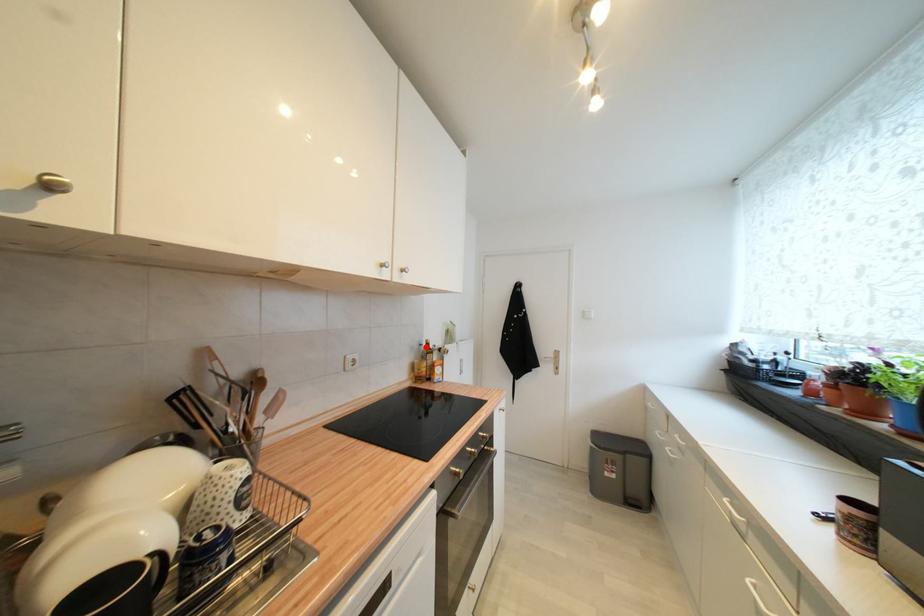
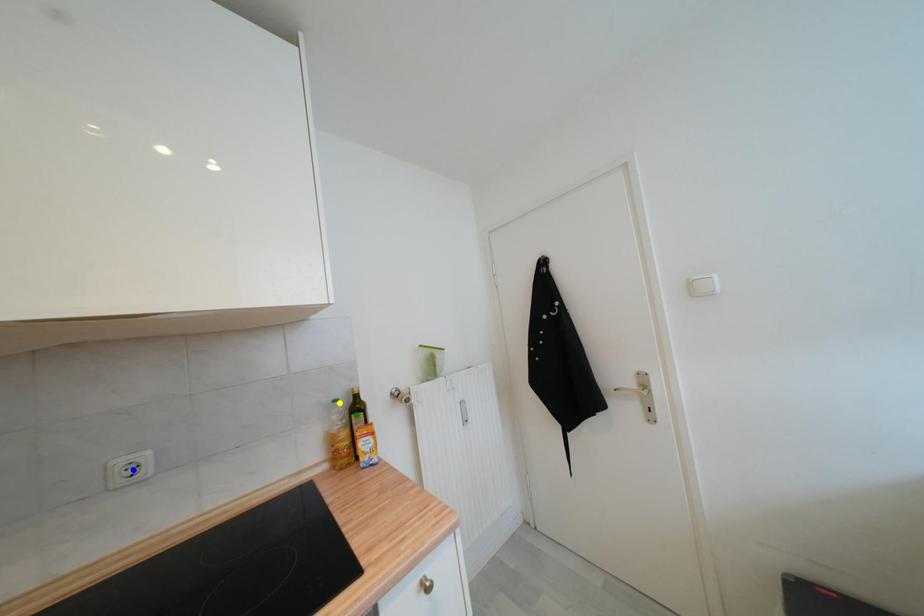
Question: I am providing you with two images of the same scene from different viewpoints. A red point is marked on the first image. You are given multiple points on the second image. Which point in image 2 is actually the same real-world point as the red point in image 1?

Choices:
 (A) yellow point
 (B) blue point
 (C) green point

Answer: (A)